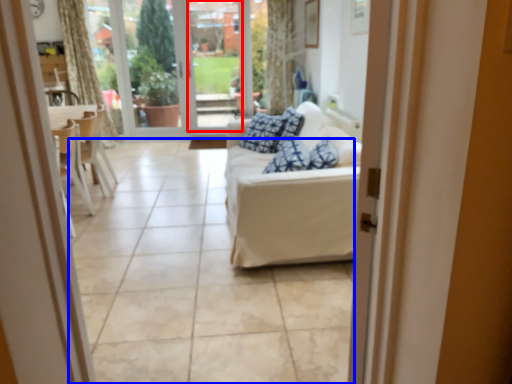
Question: Among these objects, which one is nearest to the camera, window screen (highlighted by a red box) or tile (highlighted by a blue box)?

Choices:
 (A) window screen
 (B) tile

Answer: (B)